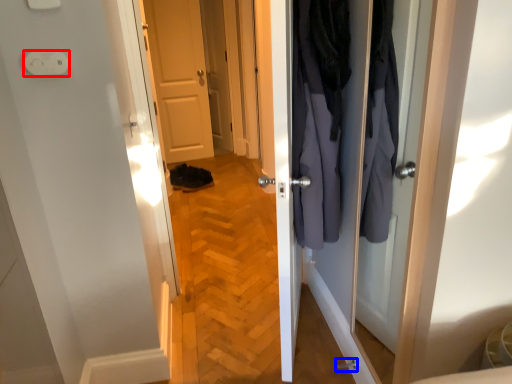
Question: Which object is further to the camera taking this photo, electric outlet (highlighted by a red box) or door handle (highlighted by a blue box)?

Choices:
 (A) electric outlet
 (B) door handle

Answer: (B)